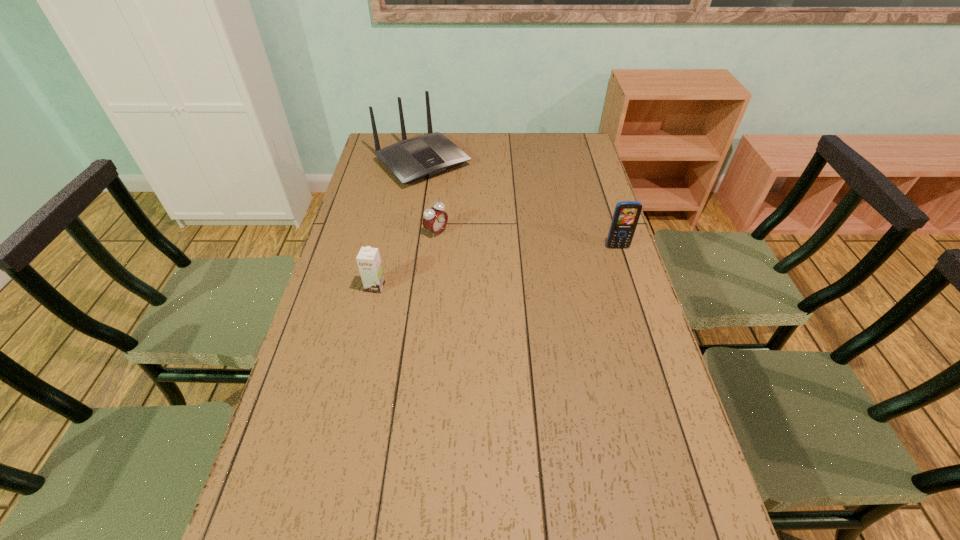
Find the location of a particular element. The height and width of the screenshot is (540, 960). free space located on the clock face of the third nearest object is located at coordinates (518, 280).

This screenshot has height=540, width=960. I want to click on vacant space located 0.090m on the clock face of the third nearest object, so click(466, 249).

Locate an element on the screen. This screenshot has width=960, height=540. blank space located on the clock face of the third nearest object is located at coordinates (511, 275).

I want to click on free location located on the front-facing side of the farthest object, so click(x=464, y=200).

Identify the location of free region located 0.090m on the front-facing side of the farthest object. The height and width of the screenshot is (540, 960). (461, 198).

The height and width of the screenshot is (540, 960). What are the coordinates of `vacant space located 0.200m on the front-facing side of the farthest object` in the screenshot? It's located at (478, 213).

I want to click on object present at the far edge, so click(x=428, y=155).

Locate an element on the screen. chocolate milk at the left edge is located at coordinates (368, 259).

Where is `router located at the left edge`? router located at the left edge is located at coordinates (428, 155).

You are a GUI agent. You are given a task and a screenshot of the screen. Output one action in this format:
    pyautogui.click(x=<x>, y=<y>)
    Task: Click on the object that is positioned at the right edge
    
    Given the screenshot: What is the action you would take?
    coord(626,214)